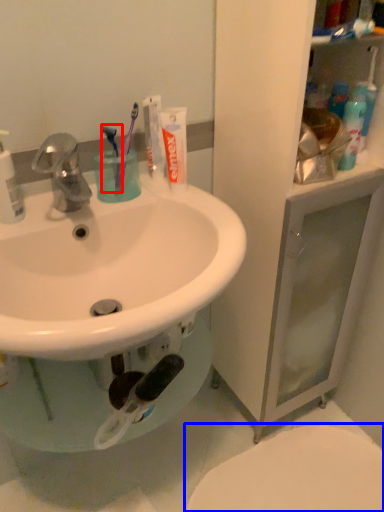
Question: Which of the following is the closest to the observer, toothbrush (highlighted by a red box) or toilet (highlighted by a blue box)?

Choices:
 (A) toothbrush
 (B) toilet

Answer: (A)